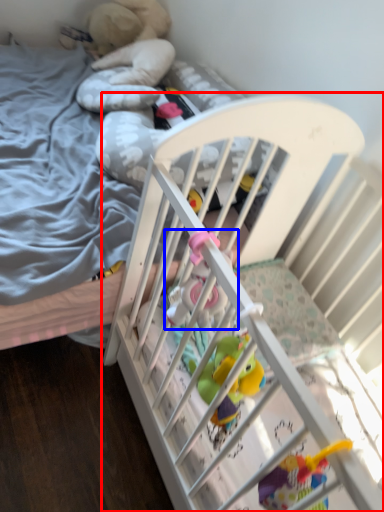
Question: Which of the following is the closest to the observer, infant bed (highlighted by a red box) or toy (highlighted by a blue box)?

Choices:
 (A) infant bed
 (B) toy

Answer: (B)